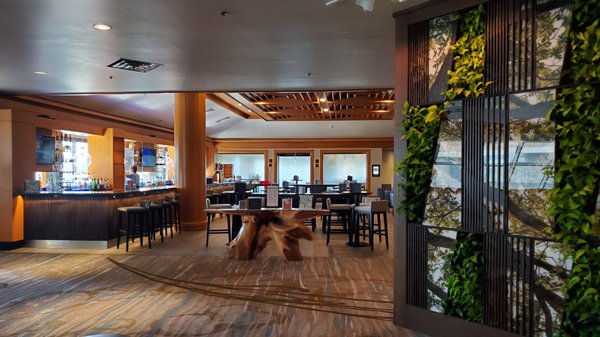
The width and height of the screenshot is (600, 337). What are the coordinates of `large windows` in the screenshot? It's located at (353, 163), (304, 163), (258, 163).